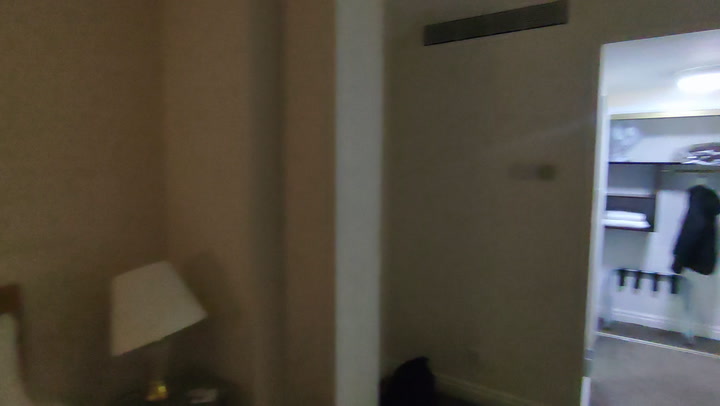
At what (x,y) coordinates should I click in order to perform the action: click on doorway. Please return your answer as a coordinate pair (x, y). Image resolution: width=720 pixels, height=406 pixels. Looking at the image, I should click on (603, 90).